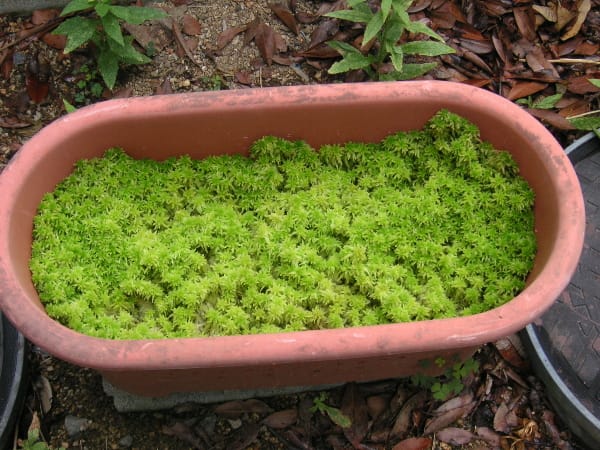
Where is `green plants`? The width and height of the screenshot is (600, 450). green plants is located at coordinates (106, 36), (385, 34), (319, 404), (450, 381).